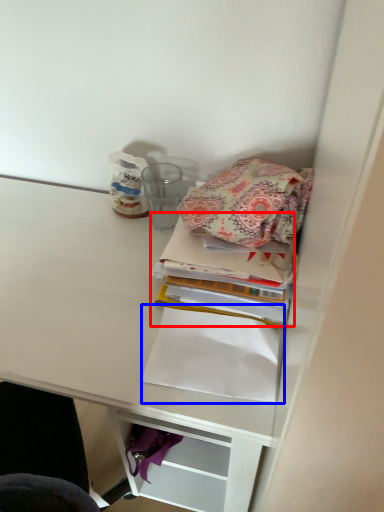
Question: Which object appears farthest to the camera in this image, book (highlighted by a red box) or notebook (highlighted by a blue box)?

Choices:
 (A) book
 (B) notebook

Answer: (A)